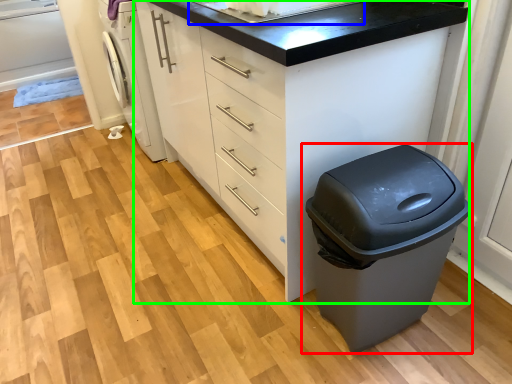
Question: Estimate the real-world distances between objects in this image. Which object is closer to waste container (highlighted by a red box), sink (highlighted by a blue box) or chest of drawers (highlighted by a green box)?

Choices:
 (A) sink
 (B) chest of drawers

Answer: (B)